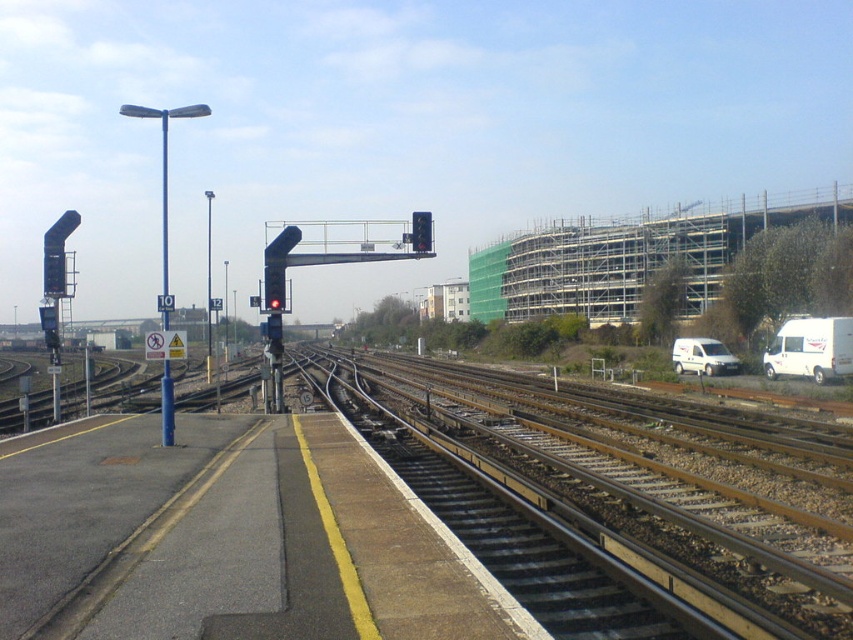
You are a maintenance worker assigned to inspect two points on the railway tracks. The first point is at coordinate point (814, 552) and the second is at point (67, 228). From your vantage point on the platform, which point would you encounter first as you walk along the tracks towards the distant curve?

Point (814, 552) is in front of point (67, 228), so you would encounter point (814, 552) first as you walk along the tracks towards the distant curve.

You are a maintenance worker needing to replace a light bulb. You have a ladder that can reach up to 4 meters. The blue metallic pole at center and the black plastic traffic light at left both have bulbs that need replacing. Which object can you reach with your ladder?

The blue metallic pole at center is taller than the black plastic traffic light at left. Since the ladder can reach up to 4 meters, you can only reach the black plastic traffic light at left if its height is under 4 meters. However, since the blue metallic pole is taller, it likely exceeds the ladder capacity. Therefore, you can only replace the bulb on the black plastic traffic light at left.